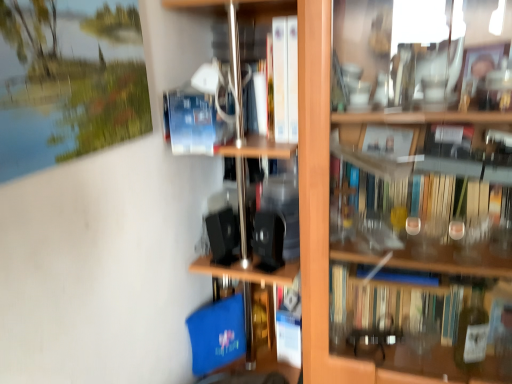
Question: From the image's perspective, is wooden shelf at center on blue matte paperback book at center?

Choices:
 (A) yes
 (B) no

Answer: (B)

Question: Does wooden shelf at center have a greater width compared to blue matte paperback book at center?

Choices:
 (A) no
 (B) yes

Answer: (B)

Question: Is wooden shelf at center next to blue matte paperback book at center?

Choices:
 (A) no
 (B) yes

Answer: (A)

Question: Is wooden shelf at center turned away from blue matte paperback book at center?

Choices:
 (A) no
 (B) yes

Answer: (A)

Question: Can you confirm if wooden shelf at center is positioned to the left of blue matte paperback book at center?

Choices:
 (A) no
 (B) yes

Answer: (A)

Question: From a real-world perspective, is blue matte paperback book at center positioned above or below wooden shelf at center?

Choices:
 (A) above
 (B) below

Answer: (A)

Question: Based on their sizes in the image, would you say blue matte paperback book at center is bigger or smaller than wooden shelf at center?

Choices:
 (A) big
 (B) small

Answer: (B)

Question: Is blue matte paperback book at center situated inside wooden shelf at center or outside?

Choices:
 (A) inside
 (B) outside

Answer: (A)

Question: Is blue matte paperback book at center taller or shorter than wooden shelf at center?

Choices:
 (A) short
 (B) tall

Answer: (A)

Question: In terms of height, does white paper at center look taller or shorter compared to wooden shelf at center?

Choices:
 (A) short
 (B) tall

Answer: (A)

Question: Looking at their shapes, would you say white paper at center is wider or thinner than wooden shelf at center?

Choices:
 (A) wide
 (B) thin

Answer: (B)

Question: Is white paper at center bigger or smaller than wooden shelf at center?

Choices:
 (A) big
 (B) small

Answer: (B)

Question: From a real-world perspective, is white paper at center positioned above or below wooden shelf at center?

Choices:
 (A) below
 (B) above

Answer: (B)

Question: Based on their positions, is white paper at center located to the left or right of blue matte paperback book at center?

Choices:
 (A) right
 (B) left

Answer: (A)

Question: Based on their sizes in the image, would you say white paper at center is bigger or smaller than blue matte paperback book at center?

Choices:
 (A) small
 (B) big

Answer: (A)